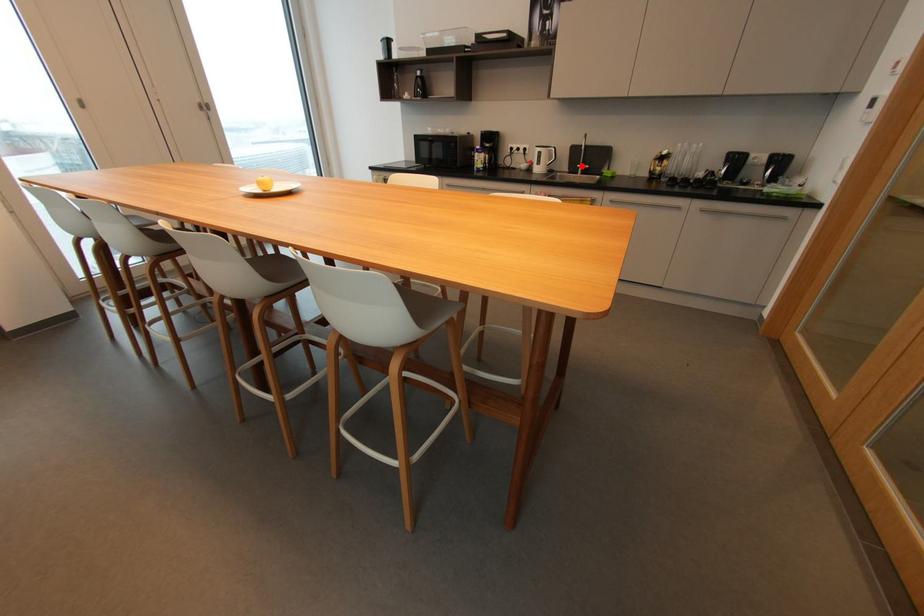
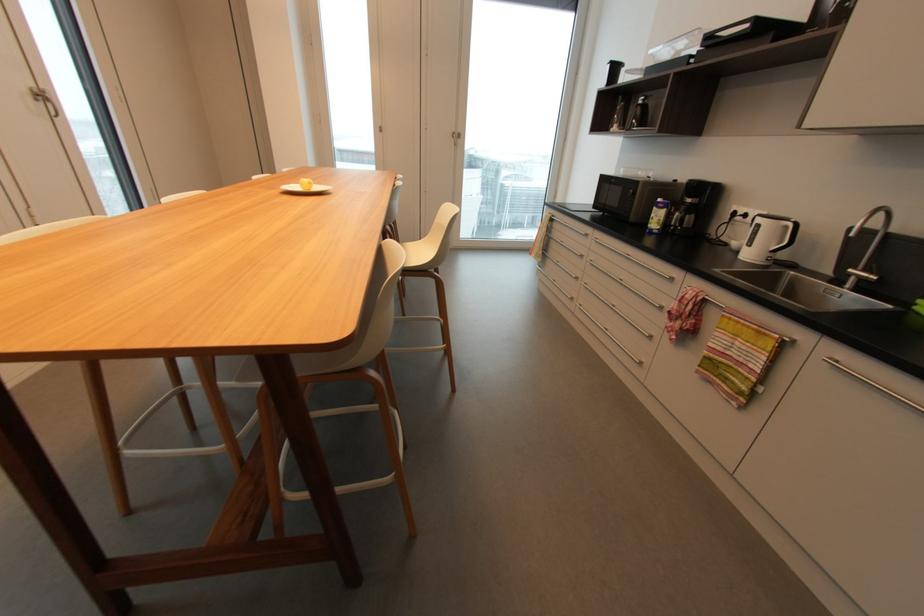
Question: I am providing you with two images of the same scene from different viewpoints. A red point is shown in image1. For the corresponding object point in image2, is it positioned nearer or farther from the camera?

Choices:
 (A) Nearer
 (B) Farther

Answer: (B)